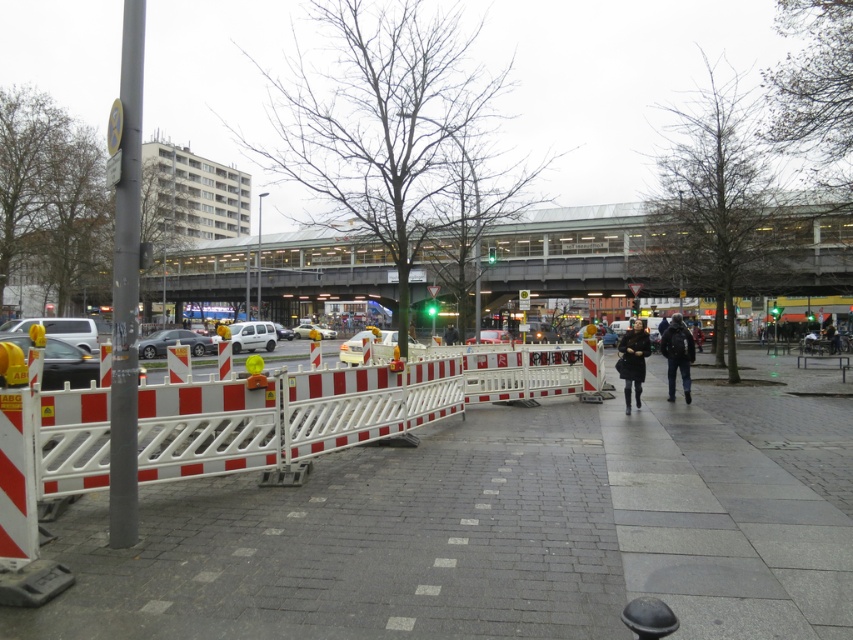
You are a delivery person trying to navigate through the construction area. You see a white plastic car at center and a matte silver car at center. Which car should you avoid to stay on the correct path?

You should avoid the matte silver car at center because the white plastic car at center is to its right, indicating the correct path is on the right side of the silver car.

You are a delivery person carrying a dark blue backpack at center and need to place it next to a white matte van at center. Can you estimate if the backpack will fit in the space next to the van without exceeding its width?

The dark blue backpack at center has a lesser width compared to the white matte van at center, so the backpack will fit next to the van without exceeding its width.

You are a delivery person trying to navigate through the urban scene. You see a white plastic car at center and a matte silver car at center. Which car is blocking the path of the other?

The white plastic car at center is positioned over matte silver car at center, meaning it is blocking the path of the matte silver car at center.